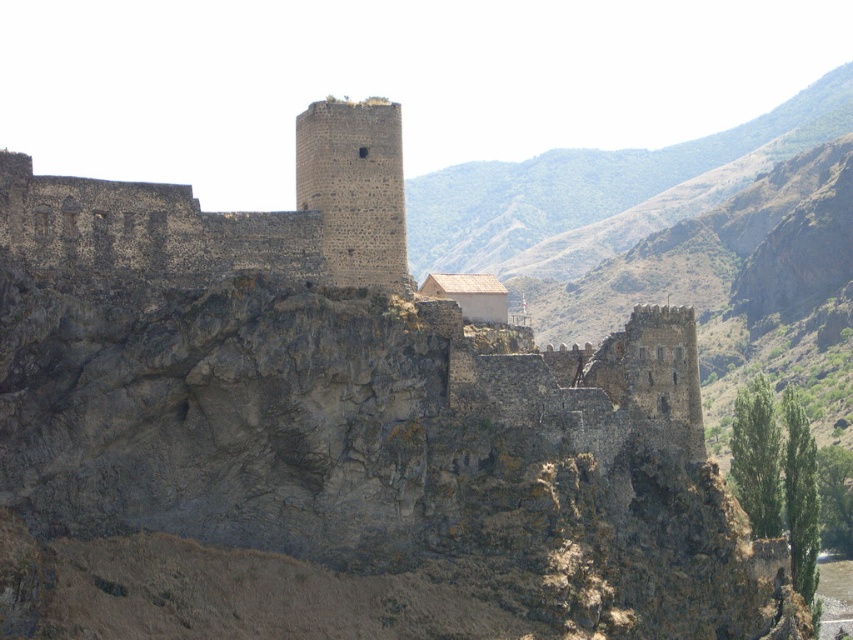
You are a bird flying over the fortress. You see the point at coordinates (230, 212). Which part of the fortress is this point located on?

The point at coordinates (230, 212) is located on the dark stone tower at upper center.

You are a medieval architect examining the fortress. You need to determine which tower has a larger footprint. Based on the description of the dark stone tower at upper center and the dark gray stone tower at center, which one is bigger?

The dark stone tower at upper center is bigger than the dark gray stone tower at center, so the dark stone tower at upper center has a larger footprint.